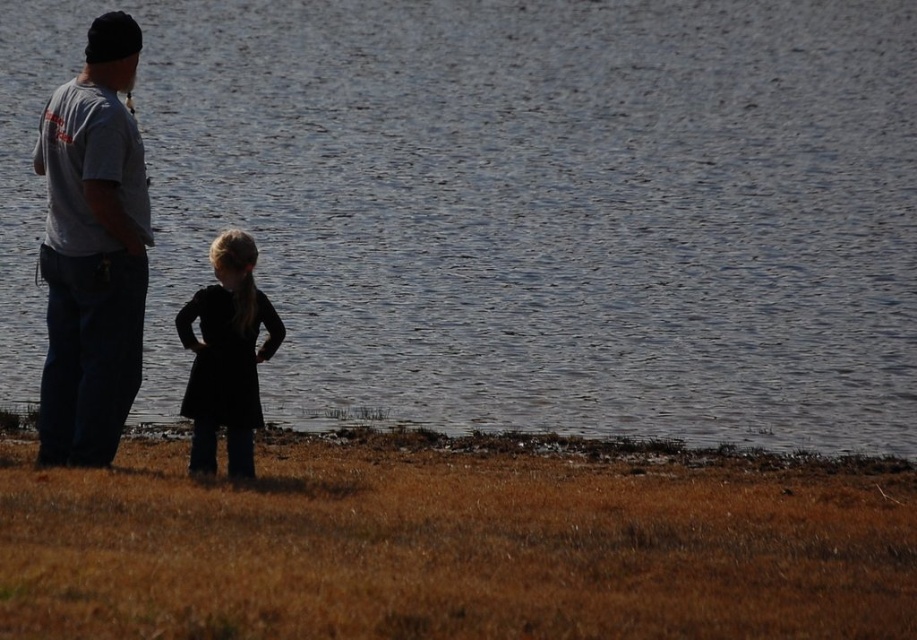
You are a photographer trying to capture a shot of the two subjects, the gray cotton shirt at left and the black matte dress at center. Since you want to ensure both are visible in the frame, which subject should you focus on first to account for their size difference?

The gray cotton shirt at left is taller than the black matte dress at center, so you should focus on the gray cotton shirt at left first to ensure proper focus on the larger subject.

You are a photographer wanting to capture a photo of the glistening water at center and the black matte dress at center. The camera you are using has a maximum focus range of 10 meters. Will you be able to focus on both objects simultaneously?

The glistening water at center is 12.59 meters from the black matte dress at center. Since the camera can only focus up to 10 meters, it cannot focus on both objects at the same time because they are more than 10 meters apart.